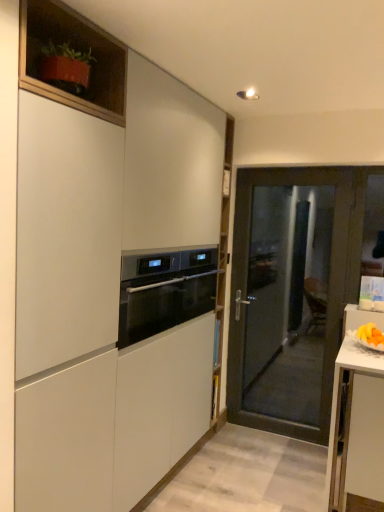
Question: Should I look upward or downward to see transparent glass door at center?

Choices:
 (A) up
 (B) down

Answer: (B)

Question: Does matte wood cabinet at upper left, which appears as the first cabinetry when viewed from the top, have a larger size compared to black glass oven at center?

Choices:
 (A) yes
 (B) no

Answer: (B)

Question: From the image's perspective, does matte wood cabinet at upper left, the second cabinetry ordered from the bottom, appear lower than black glass oven at center?

Choices:
 (A) no
 (B) yes

Answer: (A)

Question: Is matte wood cabinet at upper left, which appears as the first cabinetry when viewed from the top, far away from black glass oven at center?

Choices:
 (A) no
 (B) yes

Answer: (A)

Question: Does matte wood cabinet at upper left, which appears as the first cabinetry when viewed from the back, have a greater height compared to black glass oven at center?

Choices:
 (A) no
 (B) yes

Answer: (A)

Question: Would you say matte wood cabinet at upper left, the second cabinetry ordered from the bottom, is outside black glass oven at center?

Choices:
 (A) no
 (B) yes

Answer: (B)

Question: From the image's perspective, is matte wood cabinet at upper left, the 2th cabinetry viewed from the front, on top of black glass oven at center?

Choices:
 (A) no
 (B) yes

Answer: (B)

Question: Can you confirm if transparent glass door at center is thinner than matte white cabinet at center, the second cabinetry when ordered from top to bottom?

Choices:
 (A) no
 (B) yes

Answer: (B)

Question: Is transparent glass door at center positioned far away from matte white cabinet at center, acting as the 2th cabinetry starting from the back?

Choices:
 (A) yes
 (B) no

Answer: (A)

Question: Is transparent glass door at center turned away from matte white cabinet at center, acting as the 2th cabinetry starting from the back?

Choices:
 (A) yes
 (B) no

Answer: (B)

Question: Considering the relative positions of transparent glass door at center and matte white cabinet at center, the second cabinetry when ordered from top to bottom, in the image provided, is transparent glass door at center to the left of matte white cabinet at center, the second cabinetry when ordered from top to bottom, from the viewer's perspective?

Choices:
 (A) yes
 (B) no

Answer: (B)

Question: Does transparent glass door at center have a smaller size compared to matte white cabinet at center, which is the 1th cabinetry in front-to-back order?

Choices:
 (A) yes
 (B) no

Answer: (A)

Question: Considering the relative sizes of transparent glass door at center and matte white cabinet at center, which is the 1th cabinetry in front-to-back order, in the image provided, is transparent glass door at center taller than matte white cabinet at center, which is the 1th cabinetry in front-to-back order,?

Choices:
 (A) no
 (B) yes

Answer: (A)

Question: Is black glass oven at center facing away from matte white cabinet at center, acting as the 2th cabinetry starting from the back?

Choices:
 (A) yes
 (B) no

Answer: (A)